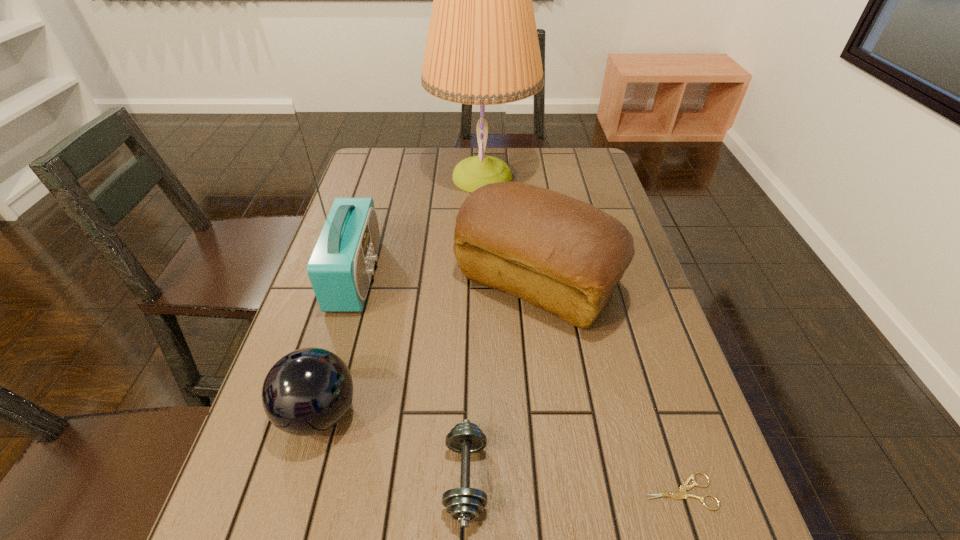
Locate an element on the screen. vacant space at the far edge of the desktop is located at coordinates (521, 172).

I want to click on free space at the left edge of the desktop, so click(x=251, y=444).

The height and width of the screenshot is (540, 960). Identify the location of free space at the right edge of the desktop. (650, 301).

Identify the location of empty space that is in between the shears and the bowling ball. (499, 452).

In order to click on free space between the fifth tallest object and the farthest object in this screenshot , I will do `click(474, 327)`.

Locate an element on the screen. This screenshot has width=960, height=540. free spot between the radio receiver and the dumbbell is located at coordinates (411, 377).

This screenshot has height=540, width=960. What are the coordinates of `free space between the second tallest object and the dumbbell` in the screenshot? It's located at (411, 377).

Find the location of a particular element. empty space that is in between the dumbbell and the shears is located at coordinates (572, 485).

Locate an element on the screen. This screenshot has width=960, height=540. free space that is in between the lamp and the shortest object is located at coordinates (581, 334).

You are a GUI agent. You are given a task and a screenshot of the screen. Output one action in this format:
    pyautogui.click(x=<x>, y=<y>)
    Task: Click on the unoccupied area between the fourth tallest object and the shears
    This screenshot has height=540, width=960.
    Given the screenshot: What is the action you would take?
    pyautogui.click(x=499, y=452)